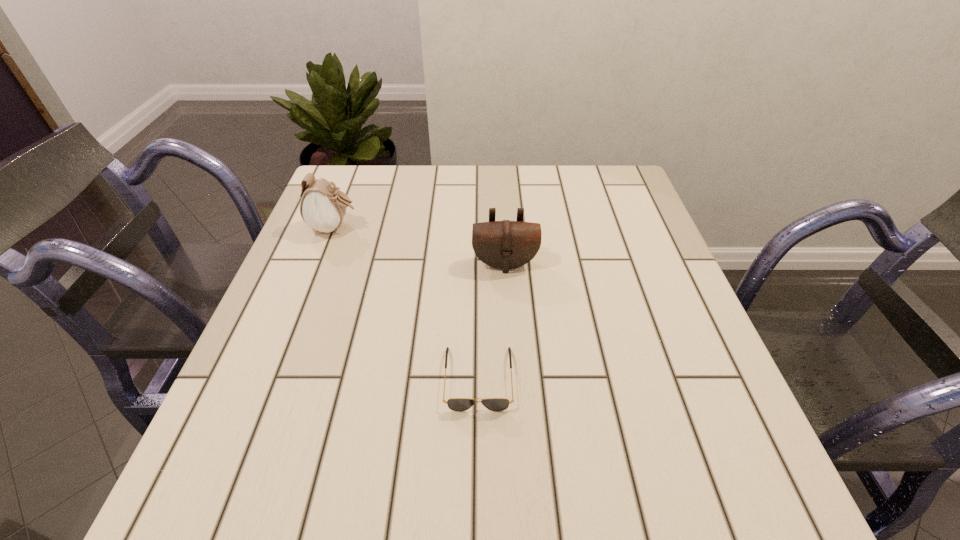
You are a GUI agent. You are given a task and a screenshot of the screen. Output one action in this format:
    pyautogui.click(x=<x>, y=<y>)
    Task: Click on the free point between the nearer pouch and the leftmost object
    The image size is (960, 540).
    Given the screenshot: What is the action you would take?
    pyautogui.click(x=420, y=246)

Locate an element on the screen. This screenshot has width=960, height=540. vacant space that's between the sunglasses and the nearer pouch is located at coordinates (492, 321).

Identify the location of free space between the leftmost object and the shortest object. This screenshot has width=960, height=540. (406, 303).

You are a GUI agent. You are given a task and a screenshot of the screen. Output one action in this format:
    pyautogui.click(x=<x>, y=<y>)
    Task: Click on the free space between the second nearest object and the sunglasses
    Image resolution: width=960 pixels, height=540 pixels.
    Given the screenshot: What is the action you would take?
    pyautogui.click(x=492, y=321)

At what (x,y) coordinates should I click in order to perform the action: click on vacant space in between the nearest object and the farther pouch. Please return your answer as a coordinate pair (x, y). This screenshot has width=960, height=540. Looking at the image, I should click on (406, 303).

The image size is (960, 540). I want to click on vacant region between the right pouch and the nearest object, so click(492, 321).

Where is `object that stands as the second closest to the right pouch`? This screenshot has width=960, height=540. object that stands as the second closest to the right pouch is located at coordinates (323, 207).

Locate which object ranks second in proximity to the nearer pouch. Please provide its 2D coordinates. Your answer should be formatted as a tuple, i.e. [(x, y)], where the tuple contains the x and y coordinates of a point satisfying the conditions above.

[(323, 207)]